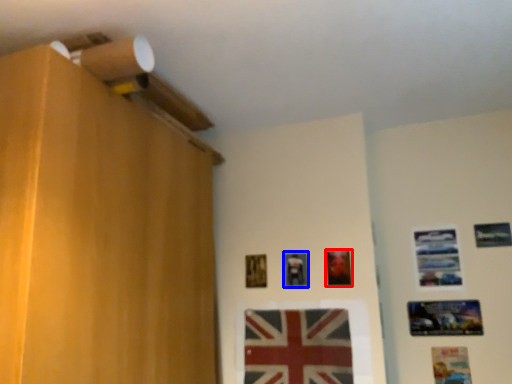
Question: Which of the following is the closest to the observer, picture frame (highlighted by a red box) or picture frame (highlighted by a blue box)?

Choices:
 (A) picture frame
 (B) picture frame

Answer: (A)